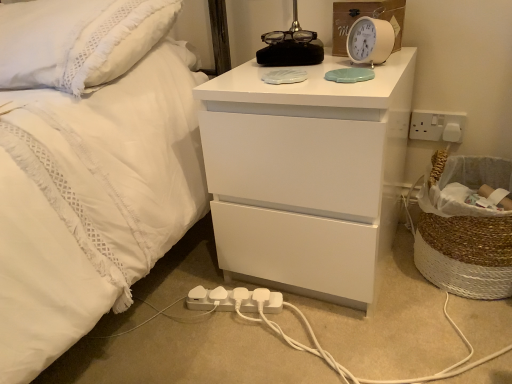
Identify the location of vacant region to the right of white plastic extension cord at lower center. tap(305, 321).